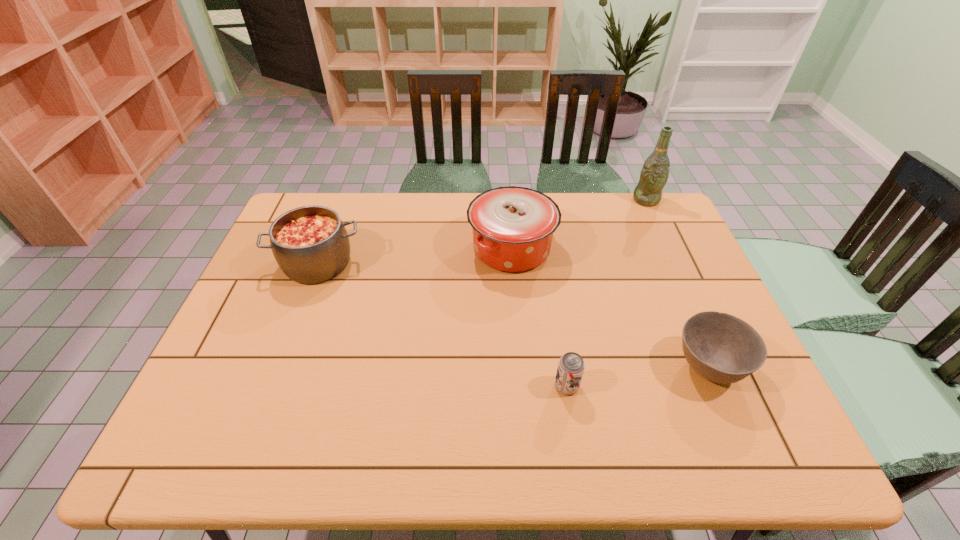
What are the coordinates of `beer bottle` in the screenshot? It's located at (655, 172).

The image size is (960, 540). What are the coordinates of `the tallest object` in the screenshot? It's located at (655, 172).

This screenshot has width=960, height=540. Identify the location of the taller casserole. (513, 227).

Find the location of `the right casserole`. the right casserole is located at coordinates click(x=513, y=227).

Find the location of a particular element. This screenshot has width=960, height=540. the third shortest object is located at coordinates (310, 244).

In order to click on the left casserole in this screenshot , I will do `click(310, 244)`.

At what (x,y) coordinates should I click in order to perform the action: click on bowl. Please return your answer as a coordinate pair (x, y). The width and height of the screenshot is (960, 540). Looking at the image, I should click on (721, 348).

Where is `beer can`? beer can is located at coordinates (571, 366).

Locate an element on the screen. The width and height of the screenshot is (960, 540). vacant position located 0.240m on the surface of the beer bottle is located at coordinates (671, 254).

Identify the location of vacant space situated on the front of the right casserole. (517, 326).